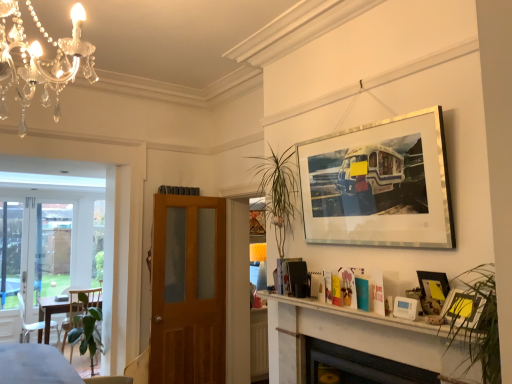
Question: Considering the relative positions of silver/metallic picture frame at upper right, which ranks as the fourth picture frame in bottom-to-top order, and green glossy plant at lower left in the image provided, is silver/metallic picture frame at upper right, which ranks as the fourth picture frame in bottom-to-top order, to the left of green glossy plant at lower left from the viewer's perspective?

Choices:
 (A) no
 (B) yes

Answer: (A)

Question: Considering the relative sizes of silver/metallic picture frame at upper right, which ranks as the fourth picture frame in bottom-to-top order, and green glossy plant at lower left in the image provided, is silver/metallic picture frame at upper right, which ranks as the fourth picture frame in bottom-to-top order, wider than green glossy plant at lower left?

Choices:
 (A) no
 (B) yes

Answer: (A)

Question: Is green glossy plant at lower left at the back of silver/metallic picture frame at upper right, the 1th picture frame viewed from the top?

Choices:
 (A) no
 (B) yes

Answer: (A)

Question: Could you tell me if silver/metallic picture frame at upper right, which ranks as the fourth picture frame in bottom-to-top order, is facing green glossy plant at lower left?

Choices:
 (A) yes
 (B) no

Answer: (B)

Question: Does silver/metallic picture frame at upper right, the 1th picture frame viewed from the top, come behind green glossy plant at lower left?

Choices:
 (A) no
 (B) yes

Answer: (A)

Question: Is white plastic thermostat at lower right, acting as the 4th picture frame starting from the top, taller or shorter than white plastic chair at lower left?

Choices:
 (A) tall
 (B) short

Answer: (B)

Question: Considering the positions of white plastic thermostat at lower right, which is the 1th picture frame from bottom to top, and white plastic chair at lower left in the image, is white plastic thermostat at lower right, which is the 1th picture frame from bottom to top, wider or thinner than white plastic chair at lower left?

Choices:
 (A) thin
 (B) wide

Answer: (A)

Question: From the image's perspective, is white plastic thermostat at lower right, acting as the 4th picture frame starting from the top, positioned above or below white plastic chair at lower left?

Choices:
 (A) below
 (B) above

Answer: (B)

Question: Visually, is white plastic thermostat at lower right, which is the 1th picture frame from bottom to top, positioned to the left or to the right of white plastic chair at lower left?

Choices:
 (A) left
 (B) right

Answer: (B)

Question: Looking at the image, does metallic silver picture frame at upper right, positioned as the 3th picture frame in top-to-bottom order, seem bigger or smaller compared to matte yellow picture frame at lower right, which appears as the 2th picture frame when viewed from the top?

Choices:
 (A) big
 (B) small

Answer: (B)

Question: Relative to matte yellow picture frame at lower right, the 3th picture frame positioned from the bottom, is metallic silver picture frame at upper right, acting as the second picture frame starting from the bottom, in front or behind?

Choices:
 (A) behind
 (B) front

Answer: (A)

Question: From the image's perspective, relative to matte yellow picture frame at lower right, the 3th picture frame positioned from the bottom, is metallic silver picture frame at upper right, positioned as the 3th picture frame in top-to-bottom order, above or below?

Choices:
 (A) above
 (B) below

Answer: (B)

Question: From a real-world perspective, is metallic silver picture frame at upper right, positioned as the 3th picture frame in top-to-bottom order, above or below matte yellow picture frame at lower right, which appears as the 2th picture frame when viewed from the top?

Choices:
 (A) above
 (B) below

Answer: (A)

Question: Considering their positions, is green glossy plant at lower left located in front of or behind black glass fireplace at lower center?

Choices:
 (A) behind
 (B) front

Answer: (A)

Question: Is point (87, 309) positioned closer to the camera than point (309, 357)?

Choices:
 (A) farther
 (B) closer

Answer: (A)